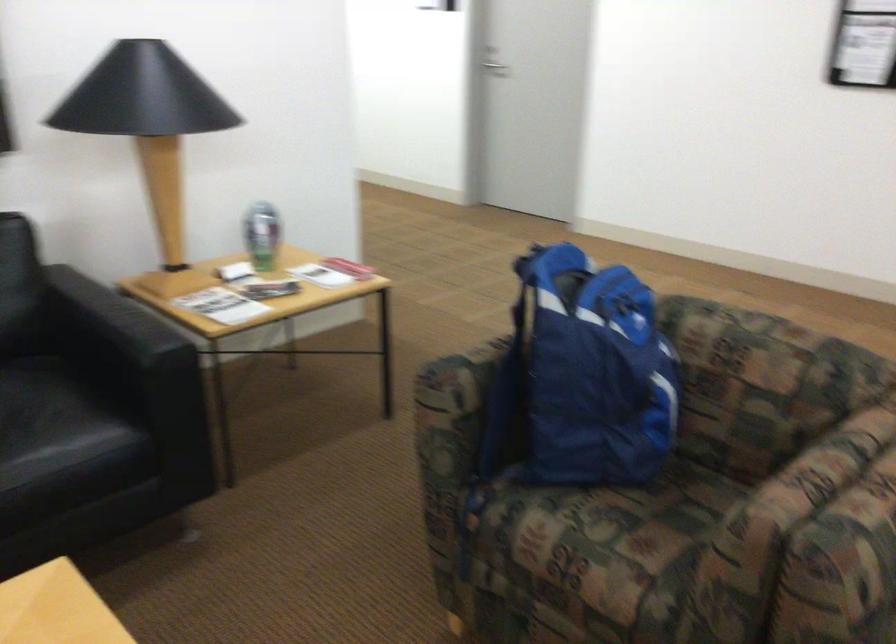
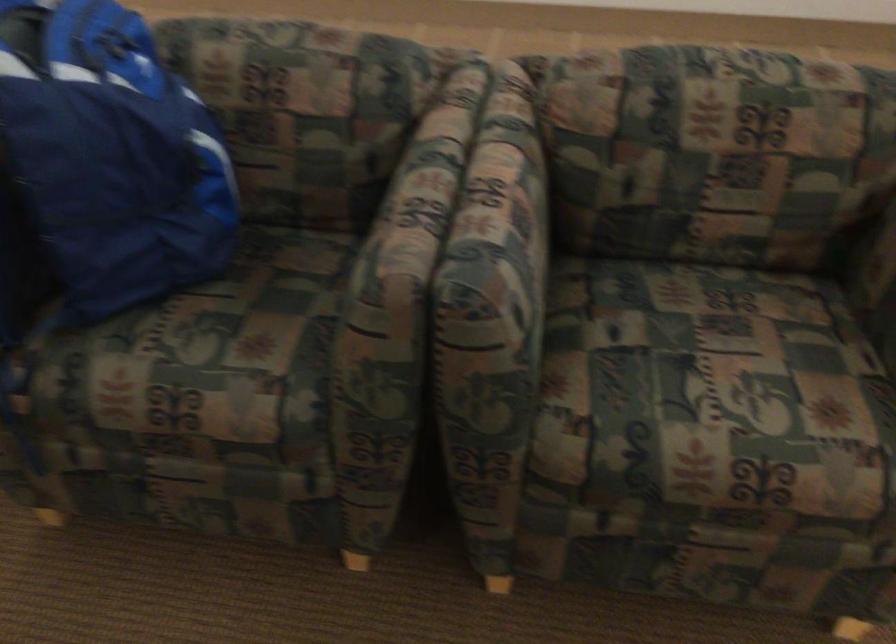
Locate, in the second image, the point that corresponds to point (600, 536) in the first image.

(199, 353)